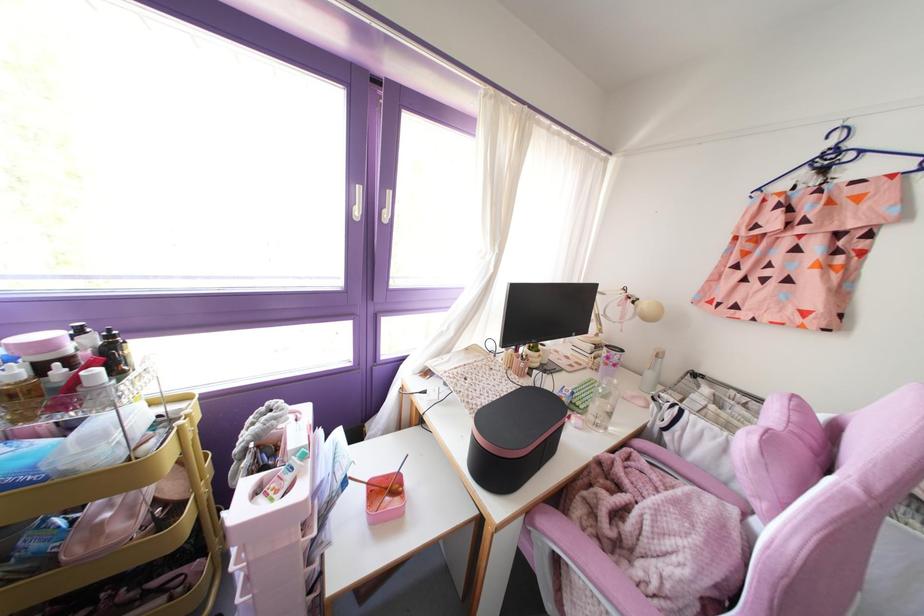
Where is `black device lid`? black device lid is located at coordinates (545, 312).